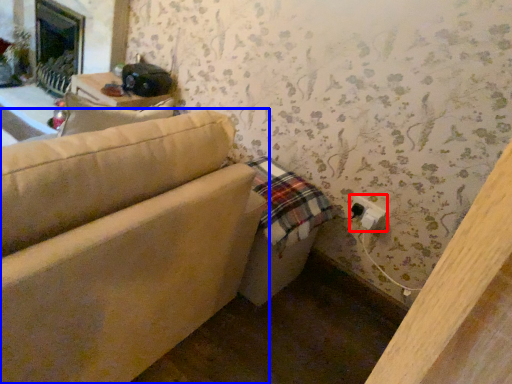
Question: Which of the following is the closest to the observer, electric outlet (highlighted by a red box) or studio couch (highlighted by a blue box)?

Choices:
 (A) electric outlet
 (B) studio couch

Answer: (B)